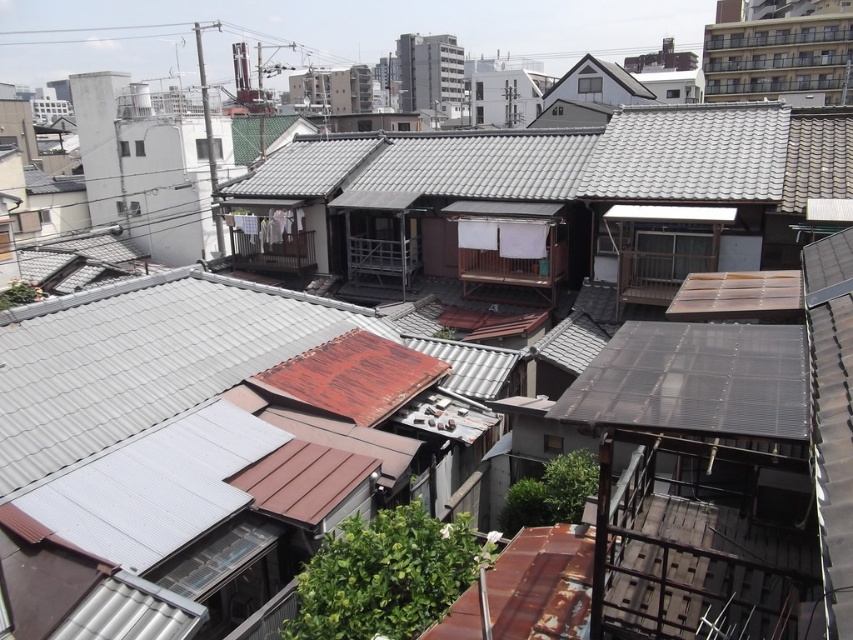
You are a delivery drone flying over the urban residential area. You need to deliver a package to a location behind both point (751, 172) and point (676, 362). Can you determine which direction you should fly to reach the target location?

Point (751, 172) is behind point (676, 362). To reach a location behind both points, you should fly further away from the drone in the direction beyond point (751, 172).